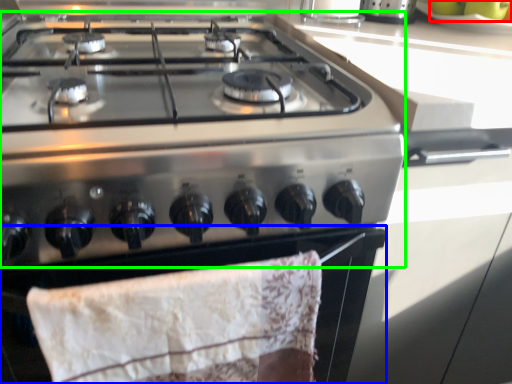
Question: Which object is the closest to the fruit (highlighted by a red box)? Choose among these: oven (highlighted by a blue box) or gas stove (highlighted by a green box).

Choices:
 (A) oven
 (B) gas stove

Answer: (B)